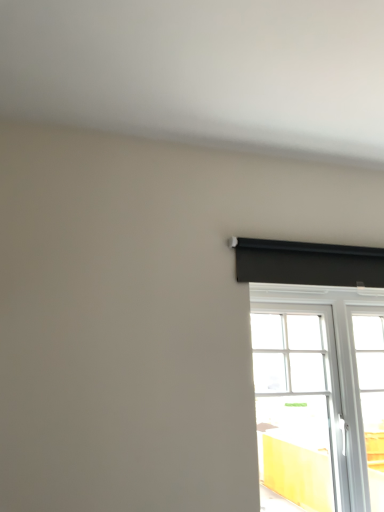
The image size is (384, 512). Describe the element at coordinates (320, 394) in the screenshot. I see `white glass window at right` at that location.

Measure the distance between point (x=252, y=290) and camera.

They are 6.15 feet apart.

Locate an element on the screen. This screenshot has height=512, width=384. white glass window at right is located at coordinates (320, 394).

Describe the element at coordinates (308, 263) in the screenshot. I see `black matte curtain at upper right` at that location.

The image size is (384, 512). What are the coordinates of `black matte curtain at upper right` in the screenshot? It's located at (308, 263).

Image resolution: width=384 pixels, height=512 pixels. In order to click on white glass window at right in this screenshot , I will do coord(320,394).

Is black matte curtain at upper right at the right side of white glass window at right?

Incorrect, black matte curtain at upper right is not on the right side of white glass window at right.

Which object is further away from the camera, black matte curtain at upper right or white glass window at right?

black matte curtain at upper right is further away from the camera.

Which is in front, point (256, 281) or point (364, 418)?

The point (256, 281) is more forward.

From the image's perspective, does black matte curtain at upper right appear lower than white glass window at right?

No, from the image's perspective, black matte curtain at upper right is not below white glass window at right.

From a real-world perspective, who is located higher, black matte curtain at upper right or white glass window at right?

In real-world perspective, black matte curtain at upper right is above.

Considering the relative sizes of black matte curtain at upper right and white glass window at right in the image provided, is black matte curtain at upper right thinner than white glass window at right?

Indeed, black matte curtain at upper right has a lesser width compared to white glass window at right.

Considering the sizes of objects black matte curtain at upper right and white glass window at right in the image provided, who is shorter, black matte curtain at upper right or white glass window at right?

Standing shorter between the two is black matte curtain at upper right.

Is black matte curtain at upper right smaller than white glass window at right?

Indeed, black matte curtain at upper right has a smaller size compared to white glass window at right.

Is black matte curtain at upper right inside or outside of white glass window at right?

black matte curtain at upper right lies outside white glass window at right.

Are black matte curtain at upper right and white glass window at right located far from each other?

No, there isn't a large distance between black matte curtain at upper right and white glass window at right.

Is black matte curtain at upper right looking in the opposite direction of white glass window at right?

No, black matte curtain at upper right is not facing away from white glass window at right.

How many degrees apart are the facing directions of black matte curtain at upper right and white glass window at right?

There is a 0.0299-degree angle between the facing directions of black matte curtain at upper right and white glass window at right.

I want to click on window on the right of black matte curtain at upper right, so click(x=320, y=394).

Considering the positions of objects white glass window at right and black matte curtain at upper right in the image provided, who is more to the left, white glass window at right or black matte curtain at upper right?

From the viewer's perspective, black matte curtain at upper right appears more on the left side.

Considering the relative positions of white glass window at right and black matte curtain at upper right in the image provided, is white glass window at right behind black matte curtain at upper right?

No, white glass window at right is closer to the camera.

Does point (334, 456) come in front of point (361, 255)?

That is False.

From the image's perspective, between white glass window at right and black matte curtain at upper right, which one is located above?

black matte curtain at upper right.

From a real-world perspective, is white glass window at right physically above black matte curtain at upper right?

No, from a real-world perspective, white glass window at right is not above black matte curtain at upper right.

Does white glass window at right have a lesser width compared to black matte curtain at upper right?

No.

In the scene shown: Considering the sizes of objects white glass window at right and black matte curtain at upper right in the image provided, who is shorter, white glass window at right or black matte curtain at upper right?

Standing shorter between the two is black matte curtain at upper right.

Based on the photo, is white glass window at right bigger than black matte curtain at upper right?

Indeed, white glass window at right has a larger size compared to black matte curtain at upper right.

Does white glass window at right contain black matte curtain at upper right?

No, black matte curtain at upper right is not surrounded by white glass window at right.

Is the surface of white glass window at right in direct contact with black matte curtain at upper right?

No, white glass window at right is not next to black matte curtain at upper right.

Could you tell me if white glass window at right is facing black matte curtain at upper right?

Yes, white glass window at right is oriented towards black matte curtain at upper right.

Locate an element on the screen. window below the black matte curtain at upper right (from a real-world perspective) is located at coordinates (320, 394).

The image size is (384, 512). I want to click on curtain that appears above the white glass window at right (from a real-world perspective), so click(308, 263).

I want to click on curtain above the white glass window at right (from the image's perspective), so click(x=308, y=263).